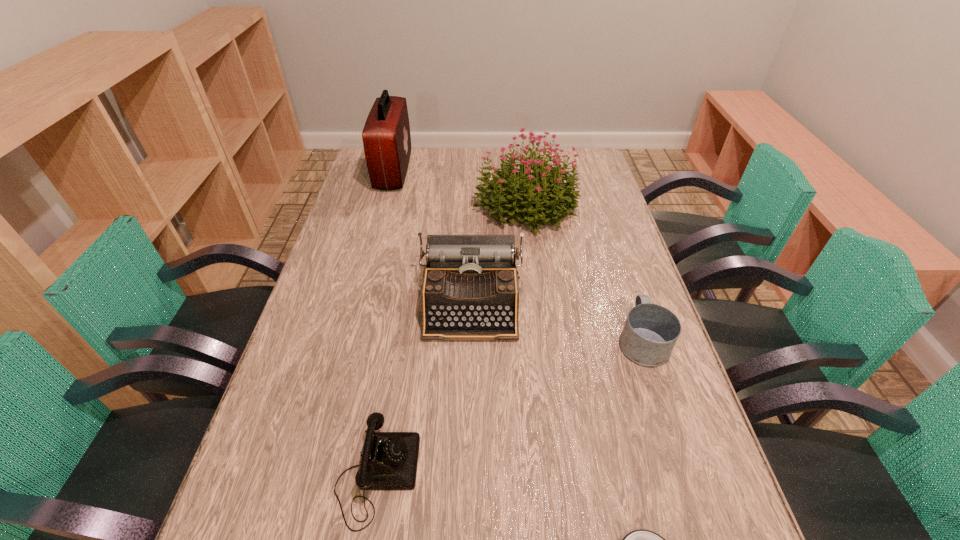
At what (x,y) coordinates should I click in order to perform the action: click on vacant area located 0.090m on the side of the mug with the handle. Please return your answer as a coordinate pair (x, y). Looking at the image, I should click on (626, 291).

You are a GUI agent. You are given a task and a screenshot of the screen. Output one action in this format:
    pyautogui.click(x=<x>, y=<y>)
    Task: Click on the vacant space located on the front face of the telephone
    
    Given the screenshot: What is the action you would take?
    pyautogui.click(x=615, y=475)

The width and height of the screenshot is (960, 540). In order to click on the first aid kit present at the far edge in this screenshot , I will do `click(386, 136)`.

Where is `bouquet that is at the far edge`? The height and width of the screenshot is (540, 960). bouquet that is at the far edge is located at coordinates (540, 193).

At what (x,y) coordinates should I click in order to perform the action: click on object that is at the left edge. Please return your answer as a coordinate pair (x, y). The width and height of the screenshot is (960, 540). Looking at the image, I should click on (386, 136).

Locate an element on the screen. bouquet situated at the right edge is located at coordinates [x=540, y=193].

This screenshot has height=540, width=960. Identify the location of mug that is at the right edge. (650, 332).

The image size is (960, 540). I want to click on object located in the far left corner section of the desktop, so click(386, 136).

Locate an element on the screen. object that is at the far right corner is located at coordinates (x=540, y=193).

This screenshot has height=540, width=960. Find the location of `vacant region at the far edge of the desktop`. vacant region at the far edge of the desktop is located at coordinates (417, 177).